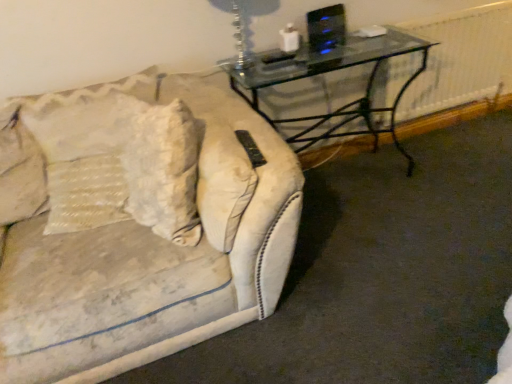
Question: Could you tell me if white textured pillow at left is turned towards transparent glass table at upper right?

Choices:
 (A) yes
 (B) no

Answer: (B)

Question: Is white textured pillow at left looking in the opposite direction of transparent glass table at upper right?

Choices:
 (A) no
 (B) yes

Answer: (A)

Question: Considering the relative sizes of white textured pillow at left and transparent glass table at upper right in the image provided, is white textured pillow at left thinner than transparent glass table at upper right?

Choices:
 (A) no
 (B) yes

Answer: (B)

Question: Does white textured pillow at left have a greater width compared to transparent glass table at upper right?

Choices:
 (A) no
 (B) yes

Answer: (A)

Question: Can you confirm if white textured pillow at left is bigger than transparent glass table at upper right?

Choices:
 (A) no
 (B) yes

Answer: (A)

Question: Considering the relative sizes of white textured pillow at left and transparent glass table at upper right in the image provided, is white textured pillow at left shorter than transparent glass table at upper right?

Choices:
 (A) no
 (B) yes

Answer: (B)

Question: Is transparent glass table at upper right to the left of white textured pillow at left from the viewer's perspective?

Choices:
 (A) yes
 (B) no

Answer: (B)

Question: From the image's perspective, does transparent glass table at upper right appear lower than white textured pillow at left?

Choices:
 (A) no
 (B) yes

Answer: (A)

Question: Can you confirm if transparent glass table at upper right is smaller than white textured pillow at left?

Choices:
 (A) no
 (B) yes

Answer: (A)

Question: Is transparent glass table at upper right next to white textured pillow at left?

Choices:
 (A) no
 (B) yes

Answer: (A)

Question: Considering the relative sizes of transparent glass table at upper right and white textured pillow at left in the image provided, is transparent glass table at upper right taller than white textured pillow at left?

Choices:
 (A) no
 (B) yes

Answer: (B)

Question: Is transparent glass table at upper right outside white textured pillow at left?

Choices:
 (A) yes
 (B) no

Answer: (A)

Question: Is white textured radiator at right aimed at transparent glass table at upper right?

Choices:
 (A) yes
 (B) no

Answer: (B)